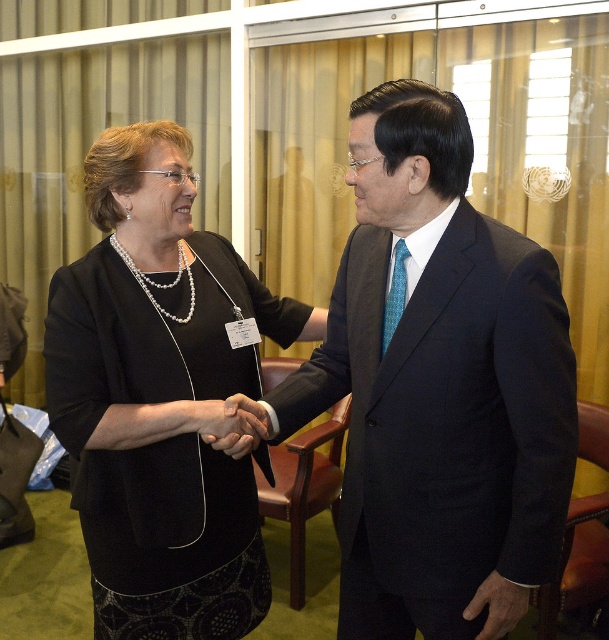
Is smooth skin handshake at center to the left of pearl necklace at center from the viewer's perspective?

No, smooth skin handshake at center is not to the left of pearl necklace at center.

Between smooth skin handshake at center and pearl necklace at center, which one has more height?

pearl necklace at center

Between point (233, 444) and point (180, 253), which one is positioned in front?

Point (233, 444) is in front.

Where is `smooth skin handshake at center`? The width and height of the screenshot is (609, 640). smooth skin handshake at center is located at coordinates (236, 424).

Which of these two, black matte dress at center or pearl necklace at center, stands taller?

Standing taller between the two is black matte dress at center.

Who is more forward, (62, 340) or (143, 285)?

Point (62, 340) is in front.

This screenshot has height=640, width=609. Describe the element at coordinates (160, 396) in the screenshot. I see `black matte dress at center` at that location.

Image resolution: width=609 pixels, height=640 pixels. In order to click on black matte dress at center in this screenshot , I will do `click(160, 396)`.

Does matte black suit at center have a greater width compared to smooth skin handshake at center?

Yes.

Does matte black suit at center have a lesser width compared to smooth skin handshake at center?

In fact, matte black suit at center might be wider than smooth skin handshake at center.

Which is in front, point (429, 204) or point (209, 403)?

Point (429, 204) is more forward.

Identify the location of matte black suit at center. (438, 387).